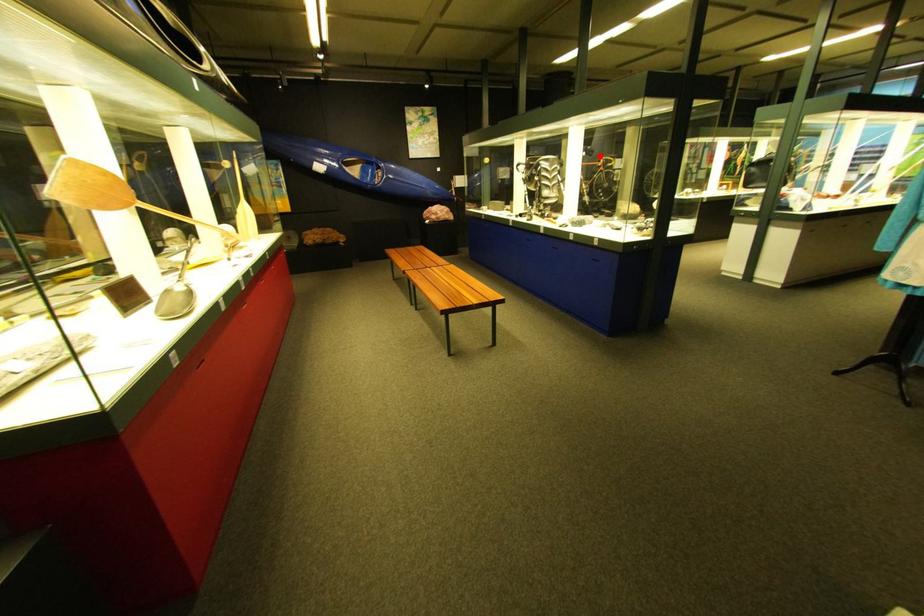
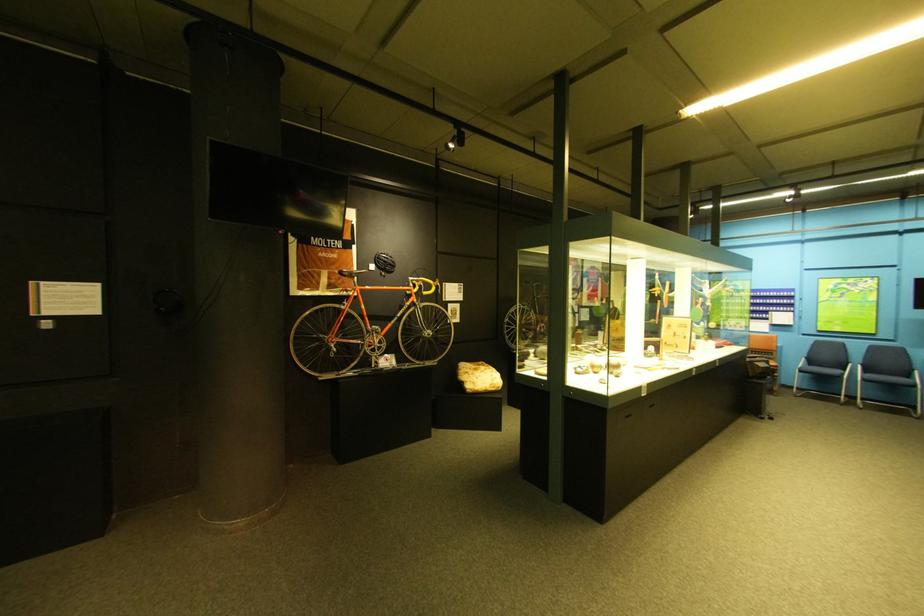
Question: I am providing you with two images of the same scene from different viewpoints. Image1 has a red point marked. In image2, the corresponding 3D location appears at what relative position? Reply with the corresponding letter.

Choices:
 (A) Closer
 (B) Farther

Answer: (B)